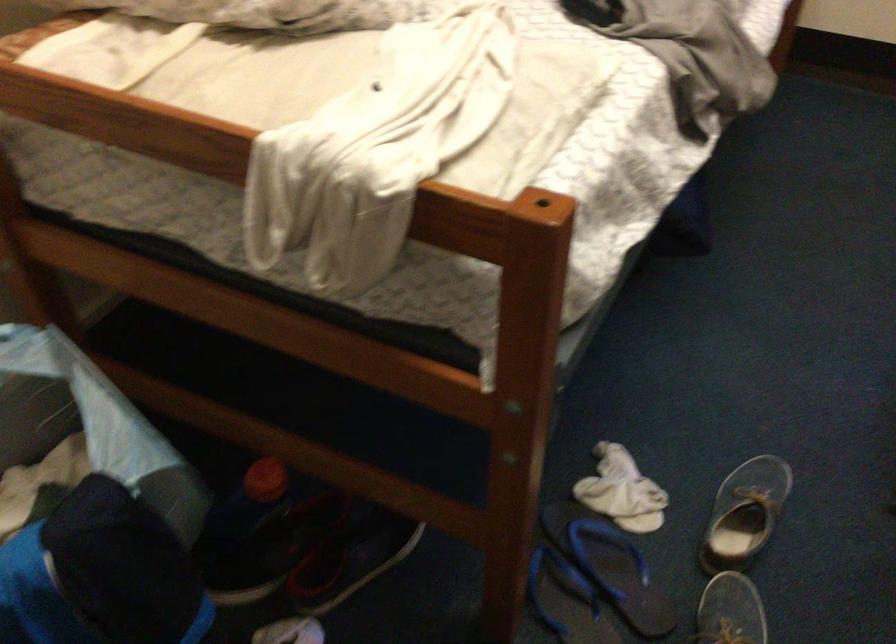
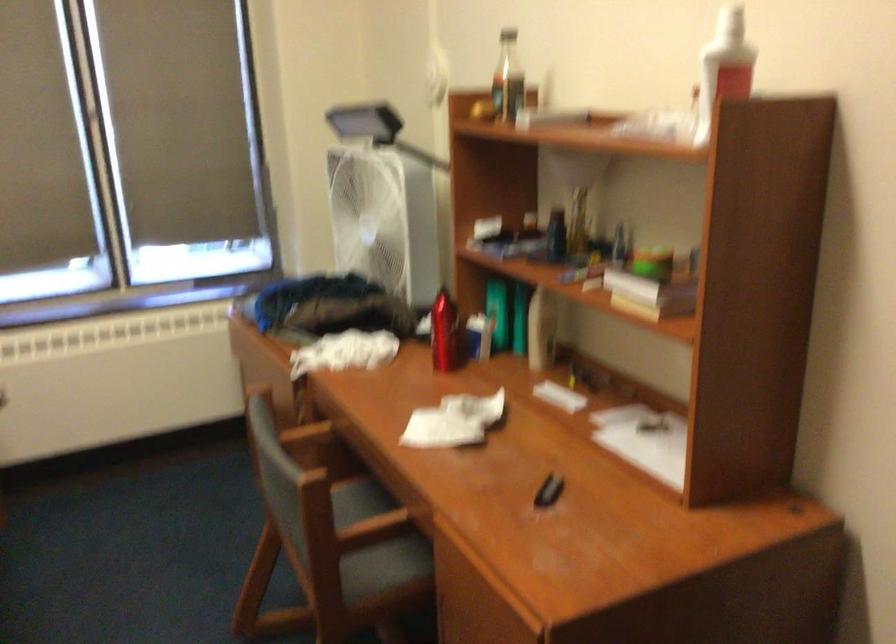
Question: How did the camera likely rotate?

Choices:
 (A) Left
 (B) Right
 (C) Up
 (D) Down

Answer: (B)